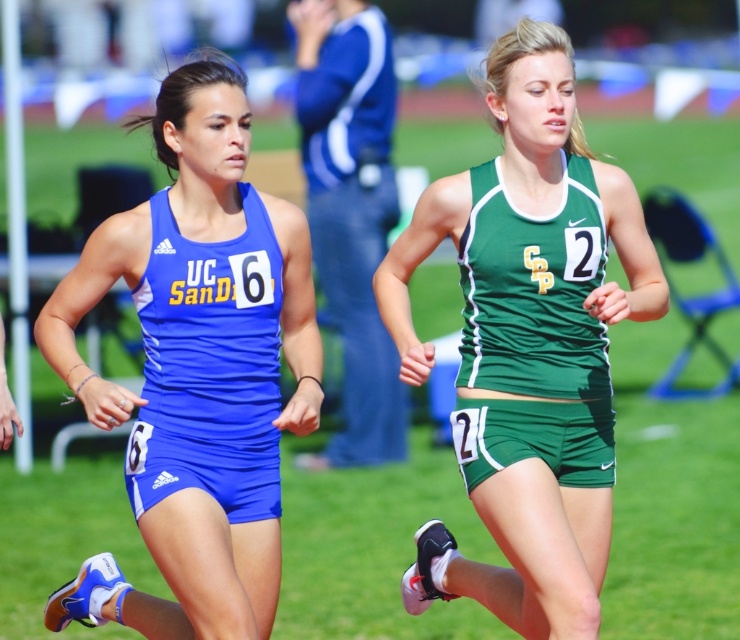
Does matte blue uniform at left have a greater width compared to matte blue tank top at center?

Yes, matte blue uniform at left is wider than matte blue tank top at center.

Which is behind, point (95, 570) or point (178, 428)?

Point (95, 570)

This screenshot has width=740, height=640. Find the location of `matte blue uniform at left`. matte blue uniform at left is located at coordinates [x=195, y=369].

Who is higher up, green fabric tank top at center or matte blue tank top at center?

green fabric tank top at center is higher up.

What do you see at coordinates (534, 333) in the screenshot? I see `green fabric tank top at center` at bounding box center [534, 333].

Identify the location of green fabric tank top at center. This screenshot has height=640, width=740. pyautogui.click(x=534, y=333).

Is green matte tank top at center positioned behind green fabric tank top at center?

No, green matte tank top at center is in front of green fabric tank top at center.

Does point (585, 214) come farther from viewer compared to point (511, 369)?

No.

Identify the location of green matte tank top at center. The image size is (740, 640). (528, 344).

Identify the location of green matte tank top at center. Image resolution: width=740 pixels, height=640 pixels. (528, 344).